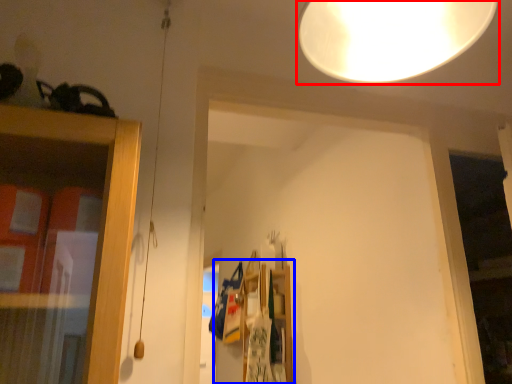
Question: Among these objects, which one is nearest to the camera, lamp (highlighted by a red box) or shelf (highlighted by a blue box)?

Choices:
 (A) lamp
 (B) shelf

Answer: (A)